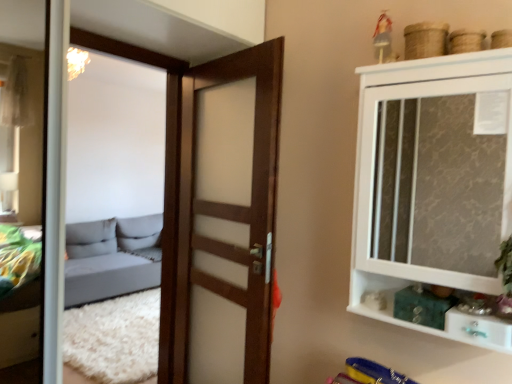
Question: Is white glossy cupboard at upper right located within wooden door at center?

Choices:
 (A) yes
 (B) no

Answer: (B)

Question: Does wooden door at center have a greater height compared to white glossy cupboard at upper right?

Choices:
 (A) yes
 (B) no

Answer: (A)

Question: Is wooden door at center to the left of white glossy cupboard at upper right from the viewer's perspective?

Choices:
 (A) yes
 (B) no

Answer: (A)

Question: Does wooden door at center have a lesser height compared to white glossy cupboard at upper right?

Choices:
 (A) yes
 (B) no

Answer: (B)

Question: From a real-world perspective, is wooden door at center located higher than white glossy cupboard at upper right?

Choices:
 (A) no
 (B) yes

Answer: (A)

Question: Visually, is wooden door at center positioned to the left or to the right of white glossy drawer at lower right?

Choices:
 (A) left
 (B) right

Answer: (A)

Question: Considering their positions, is wooden door at center located in front of or behind white glossy drawer at lower right?

Choices:
 (A) front
 (B) behind

Answer: (B)

Question: Considering the positions of point (256, 327) and point (482, 344), is point (256, 327) closer or farther from the camera than point (482, 344)?

Choices:
 (A) closer
 (B) farther

Answer: (B)

Question: Considering the positions of wooden door at center and white glossy drawer at lower right in the image, is wooden door at center wider or thinner than white glossy drawer at lower right?

Choices:
 (A) thin
 (B) wide

Answer: (A)

Question: In the image, is white glossy cupboard at upper right on the left side or the right side of wooden door at center?

Choices:
 (A) left
 (B) right

Answer: (B)

Question: Considering the positions of white glossy cupboard at upper right and wooden door at center in the image, is white glossy cupboard at upper right bigger or smaller than wooden door at center?

Choices:
 (A) big
 (B) small

Answer: (A)

Question: From a real-world perspective, is white glossy cupboard at upper right physically located above or below wooden door at center?

Choices:
 (A) below
 (B) above

Answer: (B)

Question: Is point (459, 84) closer or farther from the camera than point (184, 195)?

Choices:
 (A) closer
 (B) farther

Answer: (A)

Question: Would you say wooden door at center is to the left or to the right of white glossy cupboard at upper right in the picture?

Choices:
 (A) right
 (B) left

Answer: (B)

Question: Considering their positions, is wooden door at center located in front of or behind white glossy cupboard at upper right?

Choices:
 (A) behind
 (B) front

Answer: (A)